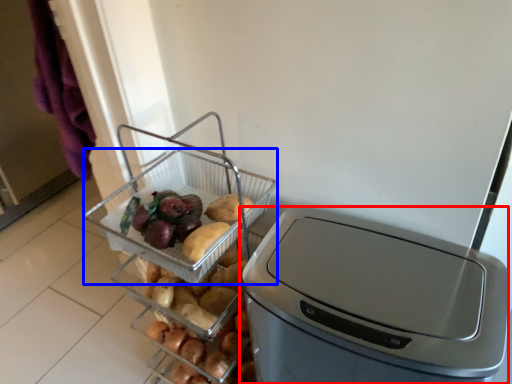
Question: Which object is further to the camera taking this photo, home appliance (highlighted by a red box) or basket (highlighted by a blue box)?

Choices:
 (A) home appliance
 (B) basket

Answer: (B)